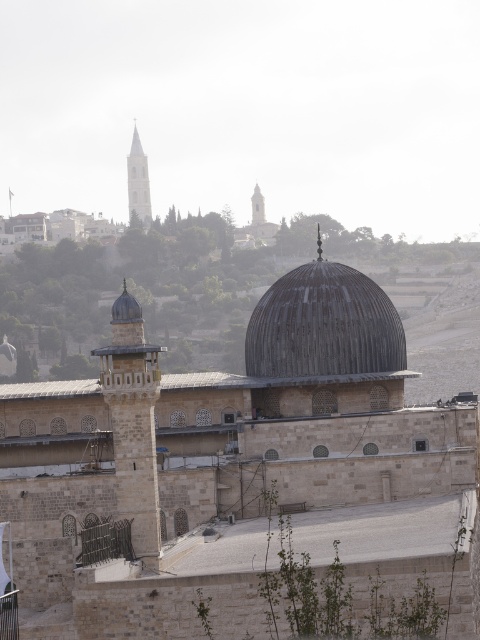
What do you see at coordinates (324, 324) in the screenshot? I see `rusty metal dome at center` at bounding box center [324, 324].

Does rusty metal dome at center appear on the right side of smooth white tower at upper left?

Correct, you'll find rusty metal dome at center to the right of smooth white tower at upper left.

The width and height of the screenshot is (480, 640). Identify the location of rusty metal dome at center. (324, 324).

Between rusty metal dome at center and smooth stone minaret at center, which one is positioned lower?

rusty metal dome at center

Is rusty metal dome at center to the left of smooth stone minaret at center from the viewer's perspective?

In fact, rusty metal dome at center is to the right of smooth stone minaret at center.

Which is in front, point (274, 317) or point (255, 214)?

Point (274, 317) is more forward.

At what (x,y) coordinates should I click in order to perform the action: click on rusty metal dome at center. Please return your answer as a coordinate pair (x, y). The image size is (480, 640). Looking at the image, I should click on (324, 324).

Is point (145, 218) more distant than point (260, 193)?

No, (145, 218) is closer to viewer.

What do you see at coordinates (137, 180) in the screenshot?
I see `smooth white tower at upper left` at bounding box center [137, 180].

This screenshot has width=480, height=640. What do you see at coordinates (137, 180) in the screenshot?
I see `smooth white tower at upper left` at bounding box center [137, 180].

This screenshot has height=640, width=480. In order to click on smooth white tower at upper left in this screenshot , I will do `click(137, 180)`.